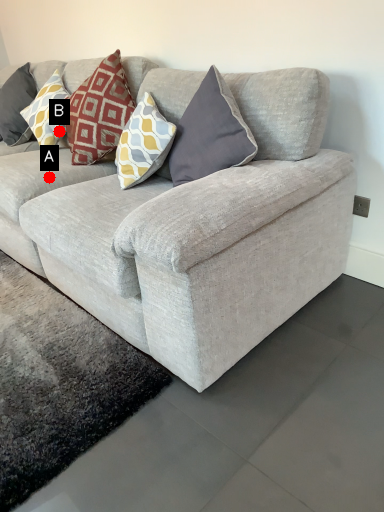
Question: Two points are circled on the image, labeled by A and B beside each circle. Which point appears farthest from the camera in this image?

Choices:
 (A) A is further
 (B) B is further

Answer: (B)